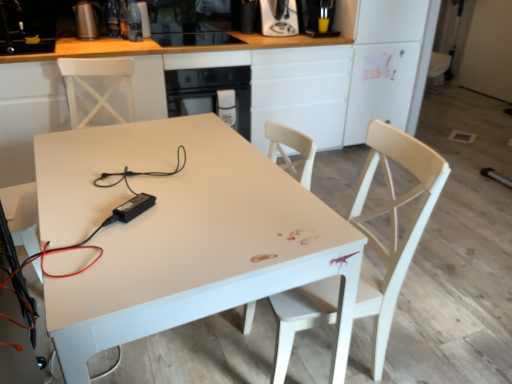
In order to click on unoccupied area in front of clear glass bottle at upper center, placed as the second appliance when sorted from left to right in this screenshot , I will do `click(126, 42)`.